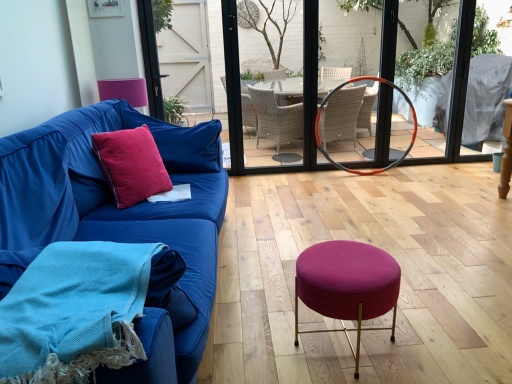
At what (x,y) coordinates should I click in order to perform the action: click on vacant space situated above velvet magenta stool at center (from a real-world perspective). Please return your answer as a coordinate pair (x, y). The width and height of the screenshot is (512, 384). Looking at the image, I should click on (347, 258).